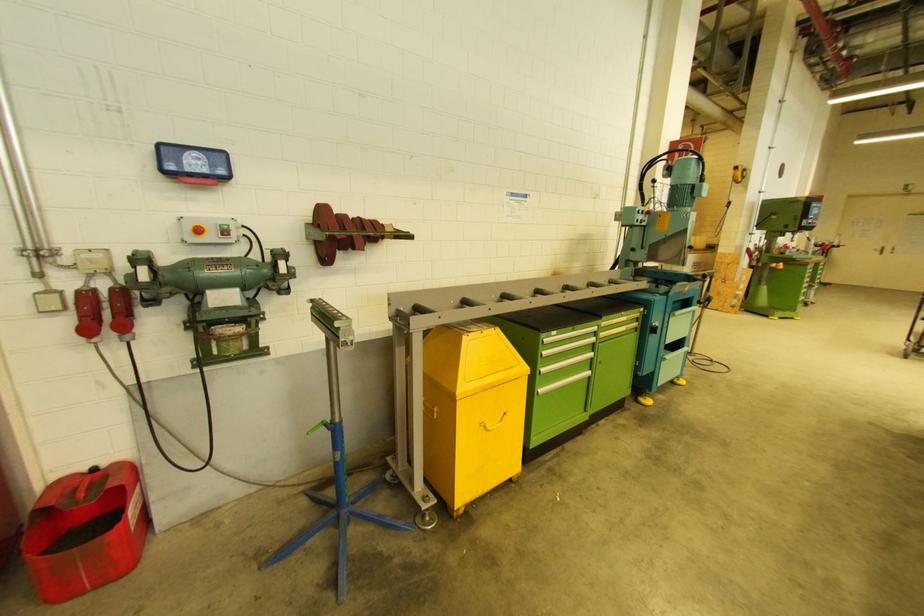
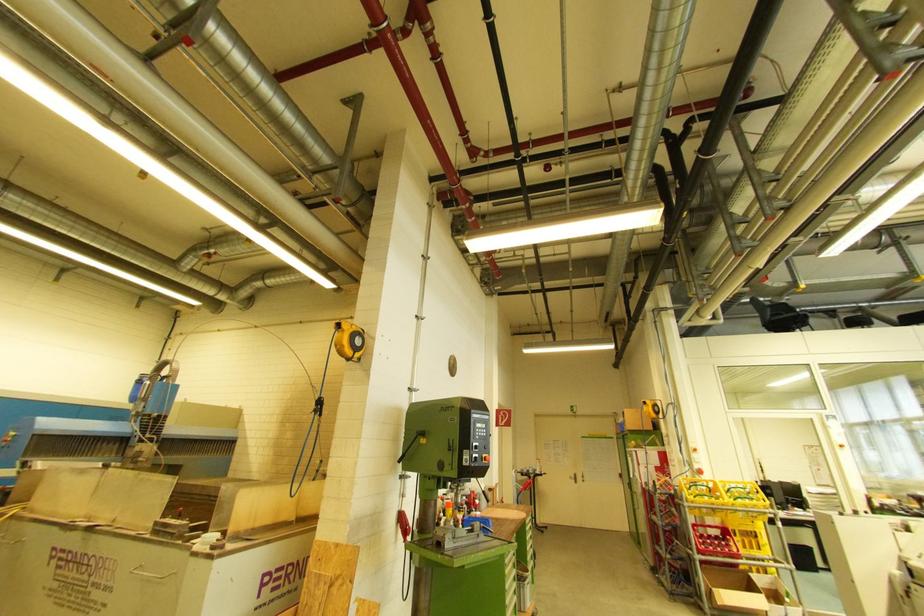
The point at (881, 251) is marked in the first image. Where is the corresponding point in the second image?

(575, 477)